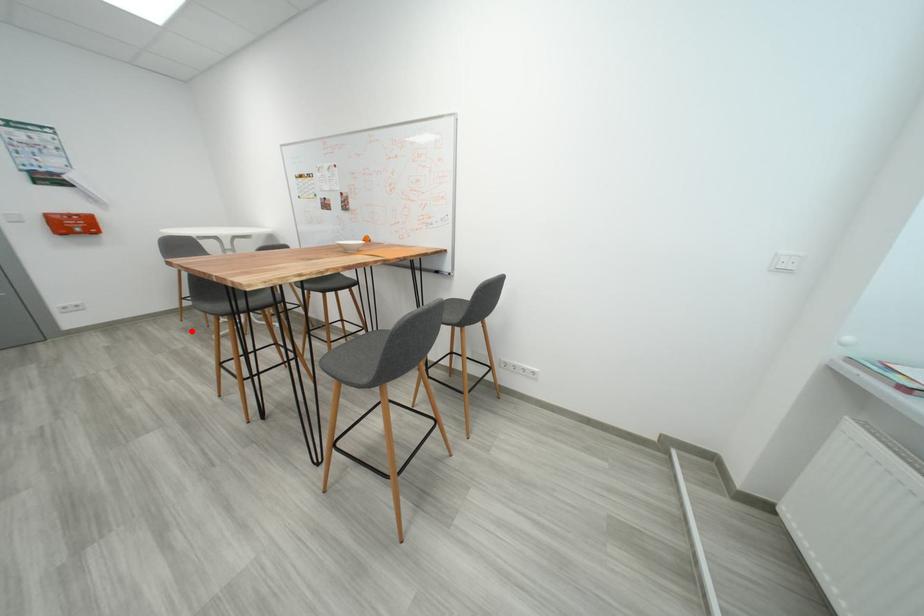
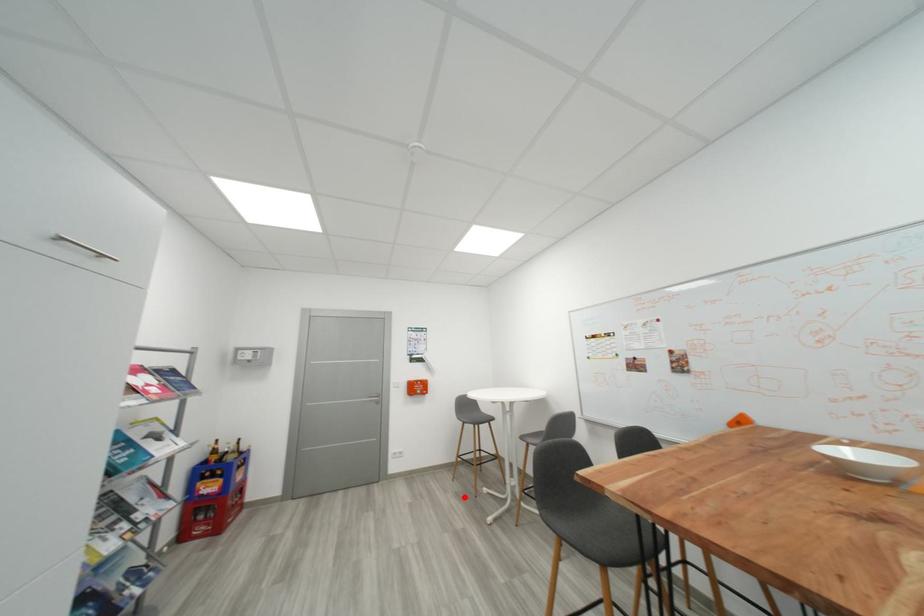
I am providing you with two images of the same scene from different viewpoints. A red point is marked on the first image and another point is marked on the second image. Do the highlighted points in image1 and image2 indicate the same real-world spot?

Yes